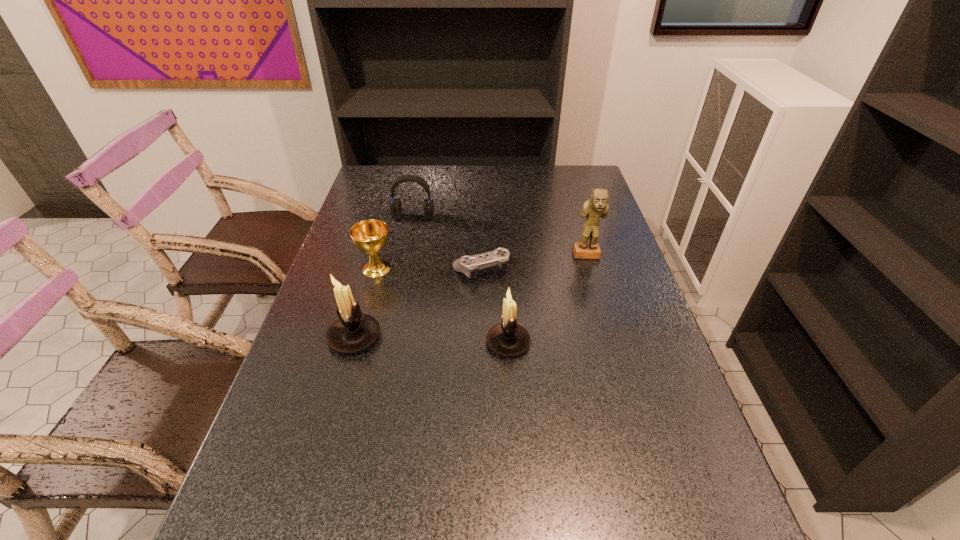
Locate an element on the screen. This screenshot has height=540, width=960. free space between the rightmost object and the headset is located at coordinates (500, 237).

This screenshot has width=960, height=540. Identify the location of vacant space in between the taller candle holder and the chalice. pyautogui.click(x=366, y=303).

Identify the location of object that is the third closest to the left candle holder. (508, 338).

At what (x,y) coordinates should I click in order to perform the action: click on object that is the fifth closest to the chalice. Please return your answer as a coordinate pair (x, y). The image size is (960, 540). Looking at the image, I should click on (596, 207).

Find the location of a particular element. The height and width of the screenshot is (540, 960). vacant area in the image that satisfies the following two spatial constraints: 1. on the front side of the control; 2. on the left side of the chalice is located at coordinates (376, 269).